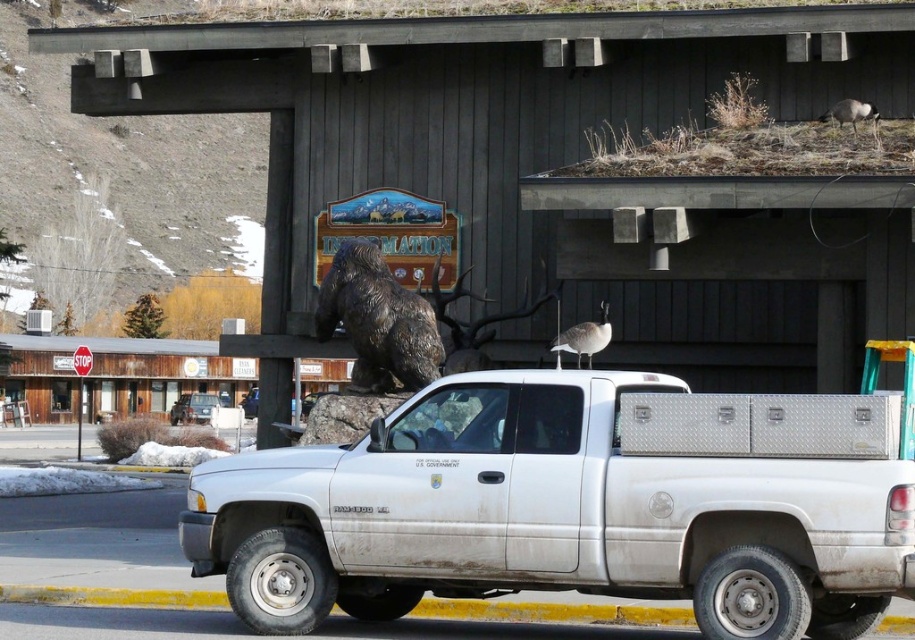
Can you confirm if bronze statue at center is wider than gray feathered goose at upper center?

No.

Image resolution: width=915 pixels, height=640 pixels. What are the coordinates of `bronze statue at center` in the screenshot? It's located at (377, 321).

Identify the location of bronze statue at center. (377, 321).

Is white aluminum truck at center shorter than gray feathered goose at upper center?

Incorrect, white aluminum truck at center's height does not fall short of gray feathered goose at upper center's.

Does point (767, 524) come in front of point (599, 342)?

Yes, point (767, 524) is closer to viewer.

Is point (666, 588) closer to camera compared to point (606, 332)?

Yes, it is.

In order to click on white aluminum truck at center in this screenshot , I will do `click(545, 513)`.

Is white aluminum truck at center closer to the viewer compared to bronze statue at center?

Yes.

Can you confirm if white aluminum truck at center is bigger than bronze statue at center?

Yes.

Where is `white aluminum truck at center`? This screenshot has width=915, height=640. white aluminum truck at center is located at coordinates (545, 513).